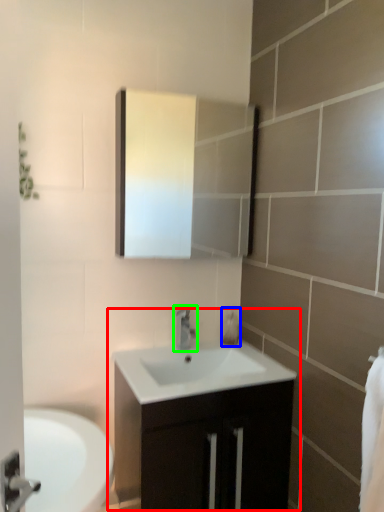
Question: Estimate the real-world distances between objects in this image. Which object is farther from bathroom cabinet (highlighted by a red box), soap dispenser (highlighted by a blue box) or tap (highlighted by a green box)?

Choices:
 (A) soap dispenser
 (B) tap

Answer: (A)